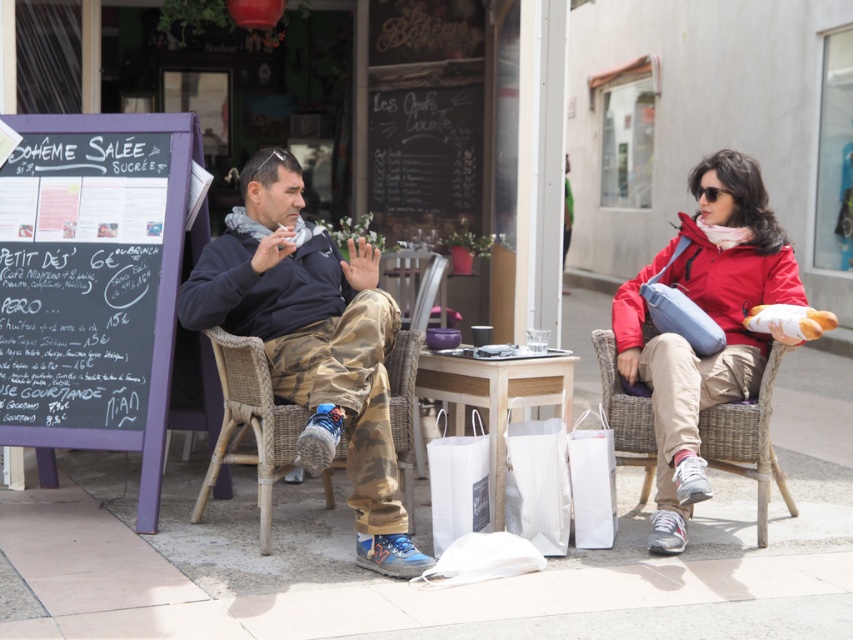
You are a delivery person who needs to pick up an item from the table. You see the white matte shopping bag at lower center and the white paper bag at lower center. Which bag is easier to reach without moving your current position?

The white matte shopping bag at lower center is closer to the viewer than the white paper bag at lower center, so it is easier to reach without moving.

You are a delivery person who needs to place a small package on the table between the two people. The package must be placed exactly at the point marked by the coordinates point (457, 483). Can you confirm if this location is clear of any objects?

The point (457, 483) corresponds to the white matte shopping bag at lower center, so placing the package there would require moving the shopping bag first.